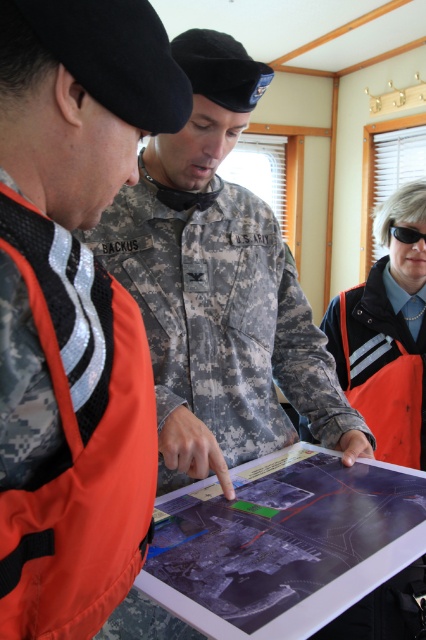
Who is positioned more to the left, orange reflective vest at center or black plastic goggles at center?

orange reflective vest at center

Does orange reflective vest at center have a lesser height compared to black plastic goggles at center?

In fact, orange reflective vest at center may be taller than black plastic goggles at center.

Is point (396, 275) less distant than point (416, 241)?

No, (396, 275) is further to viewer.

Identify the location of orange reflective vest at center. Image resolution: width=426 pixels, height=640 pixels. (388, 336).

Can you confirm if orange fabric life jacket at left is taller than orange reflective vest at center?

No, orange fabric life jacket at left is not taller than orange reflective vest at center.

I want to click on orange fabric life jacket at left, so click(74, 438).

Who is positioned more to the right, camouflage uniform at center or orange fabric life jacket at left?

Positioned to the right is camouflage uniform at center.

Who is lower down, camouflage uniform at center or orange fabric life jacket at left?

orange fabric life jacket at left

Between point (172, 141) and point (58, 355), which one is positioned behind?

The point (172, 141) is behind.

The height and width of the screenshot is (640, 426). I want to click on camouflage uniform at center, so click(x=218, y=288).